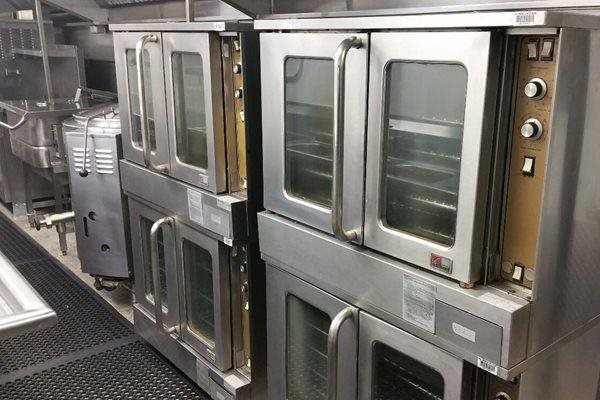
This screenshot has width=600, height=400. Find the location of `anti-slip mat`. anti-slip mat is located at coordinates (108, 375).